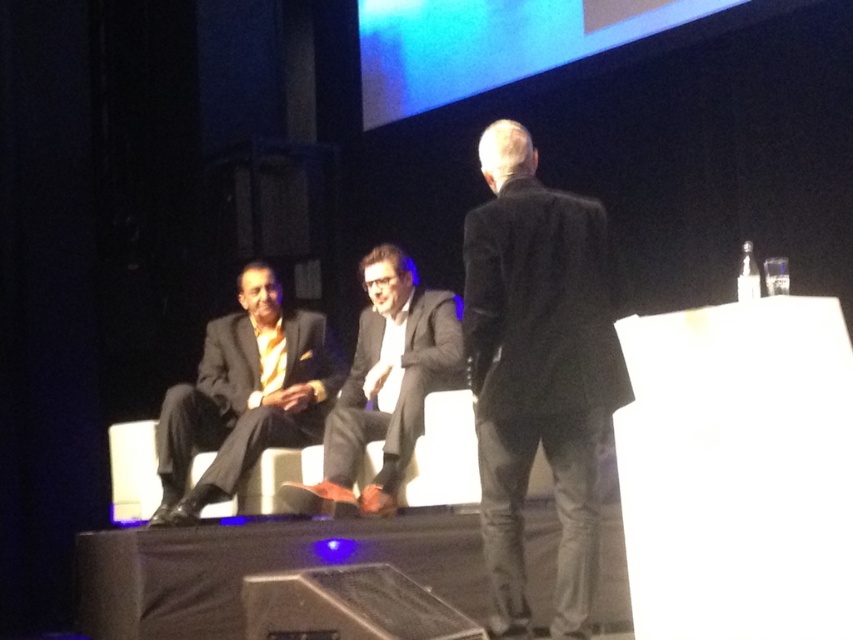
Question: Can you confirm if matte black suit at center is wider than metallic silver speaker at lower center?

Choices:
 (A) yes
 (B) no

Answer: (B)

Question: Considering the real-world distances, which object is closest to the metallic silver speaker at lower center?

Choices:
 (A) black matte suit at center
 (B) matte black suit at center
 (C) matte black suit at left

Answer: (A)

Question: Based on their relative distances, which object is farther from the matte black suit at left?

Choices:
 (A) matte black suit at center
 (B) black matte suit at center

Answer: (B)

Question: Among these points, which one is nearest to the camera?

Choices:
 (A) (534, 232)
 (B) (399, 348)
 (C) (262, 388)

Answer: (A)

Question: In this image, where is matte black suit at left located relative to metallic silver speaker at lower center?

Choices:
 (A) below
 (B) above

Answer: (B)

Question: Is matte black suit at left positioned before matte black suit at center?

Choices:
 (A) yes
 (B) no

Answer: (B)